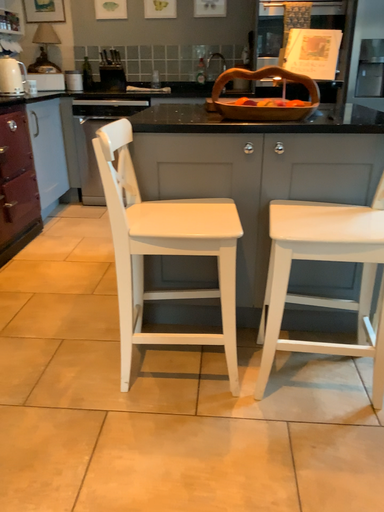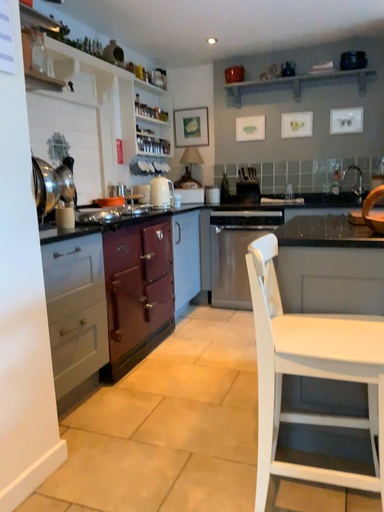
Question: Which way did the camera rotate in the video?

Choices:
 (A) rotated downward
 (B) rotated upward

Answer: (B)